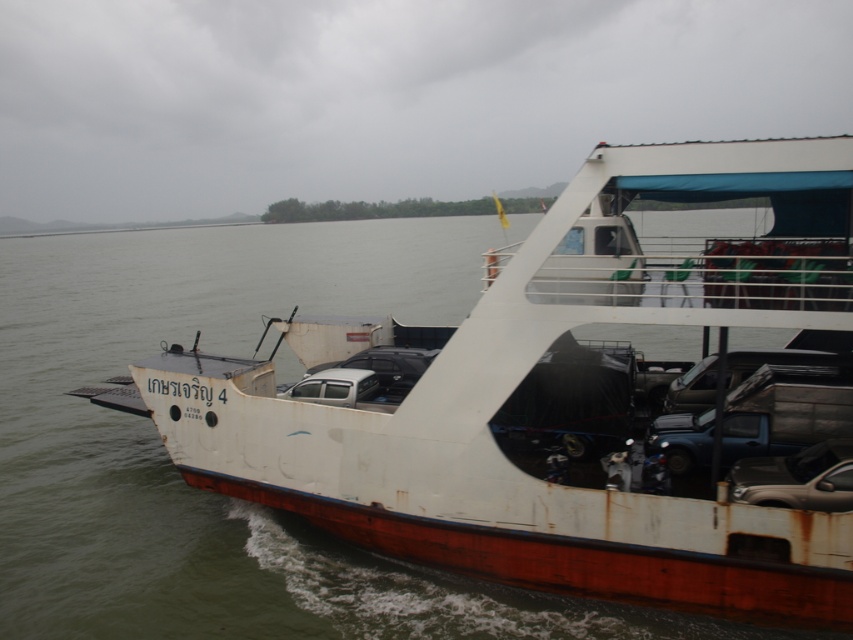
Between white matte boat at center and shiny silver car at lower right, which one appears on the right side from the viewer's perspective?

shiny silver car at lower right

Is white matte boat at center to the left of shiny silver car at lower right from the viewer's perspective?

Yes, white matte boat at center is to the left of shiny silver car at lower right.

Who is more forward, (534, 276) or (807, 492)?

Point (807, 492) is in front.

Identify the location of white matte boat at center. This screenshot has width=853, height=640. (527, 384).